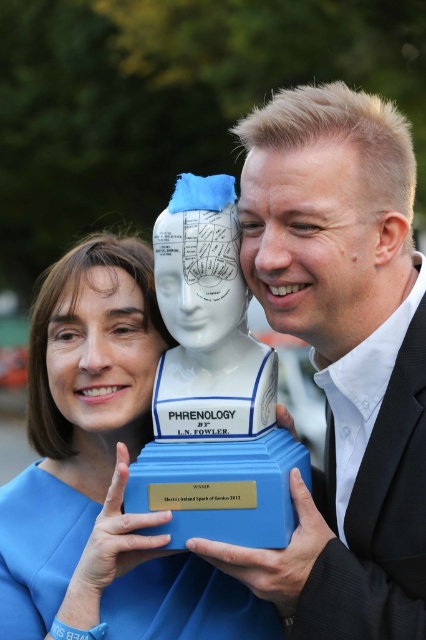
Question: Which object is the closest to the white glossy bust at center?

Choices:
 (A) blue fabric dress at center
 (B) blue plastic bust at center

Answer: (B)

Question: Can you confirm if white glossy bust at center is smaller than blue fabric dress at center?

Choices:
 (A) no
 (B) yes

Answer: (B)

Question: Is white glossy bust at center in front of blue fabric dress at center?

Choices:
 (A) yes
 (B) no

Answer: (A)

Question: Which point is farther from the camera taking this photo?

Choices:
 (A) (60, 276)
 (B) (313, 296)

Answer: (A)

Question: Where is white glossy bust at center located in relation to blue plastic bust at center in the image?

Choices:
 (A) left
 (B) right

Answer: (B)

Question: Considering the real-world distances, which object is farthest from the white glossy bust at center?

Choices:
 (A) blue plastic bust at center
 (B) blue fabric dress at center

Answer: (B)